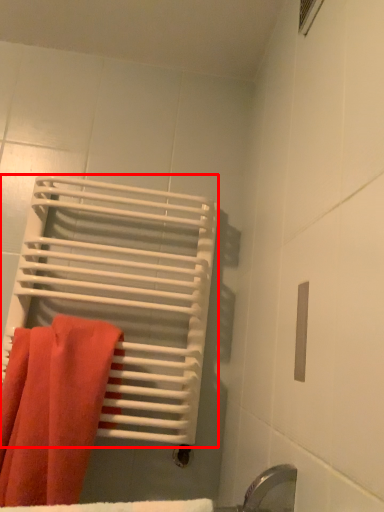
Question: From the image, what is the correct spatial relationship of bath towel (annotated by the red box) in relation to towel?

Choices:
 (A) left
 (B) right

Answer: (B)